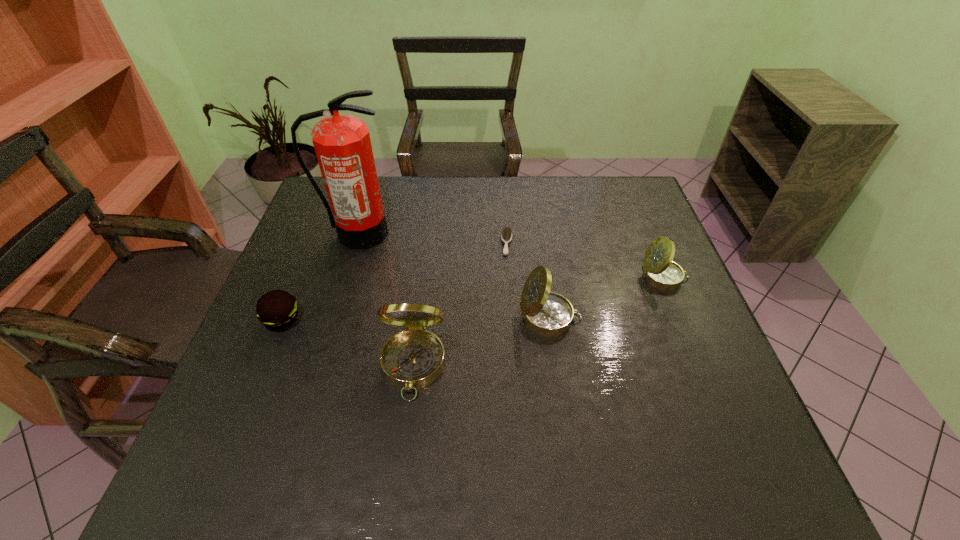
Find the location of a particular element. The height and width of the screenshot is (540, 960). blank space at the near edge of the desktop is located at coordinates point(525,406).

In order to click on free space at the left edge of the desktop in this screenshot , I will do `click(317, 255)`.

Where is `free space at the right edge of the desktop`? free space at the right edge of the desktop is located at coordinates (638, 237).

You are a GUI agent. You are given a task and a screenshot of the screen. Output one action in this format:
    pyautogui.click(x=<x>, y=<y>)
    Task: Click on the free space at the near left corner
    The width and height of the screenshot is (960, 540).
    Given the screenshot: What is the action you would take?
    [216, 427]

At what (x,y) coordinates should I click in order to perform the action: click on blank space at the far right corner of the desktop. Please return your answer as a coordinate pair (x, y). The width and height of the screenshot is (960, 540). Looking at the image, I should click on (640, 191).

In the image, there is a desktop. Identify the location of vacant space at the near right corner. The height and width of the screenshot is (540, 960). (713, 394).

In order to click on vacant region between the fourth object from right to left and the shortest object in this screenshot , I will do `click(460, 305)`.

I want to click on unoccupied area between the shortest object and the rightmost compass, so click(586, 260).

This screenshot has height=540, width=960. What are the coordinates of `free spot between the fourth tallest object and the second object from right to left` in the screenshot? It's located at (607, 298).

Identify the location of vacant area that lies between the scrubbing brush and the patty. The height and width of the screenshot is (540, 960). (395, 281).